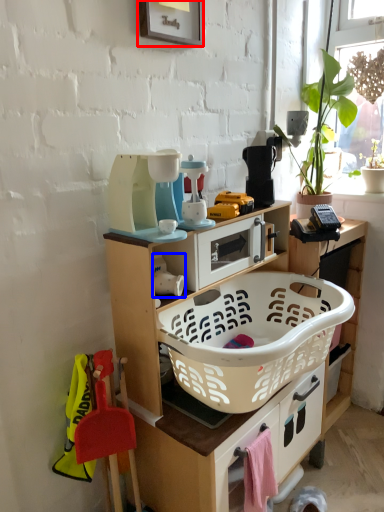
Question: Which of the following is the closest to the observer, picture frame (highlighted by a red box) or appliance (highlighted by a blue box)?

Choices:
 (A) picture frame
 (B) appliance

Answer: (A)